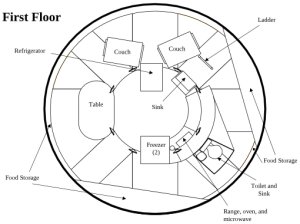
Locate an element on the screen. floor diagram is located at coordinates click(113, 129).